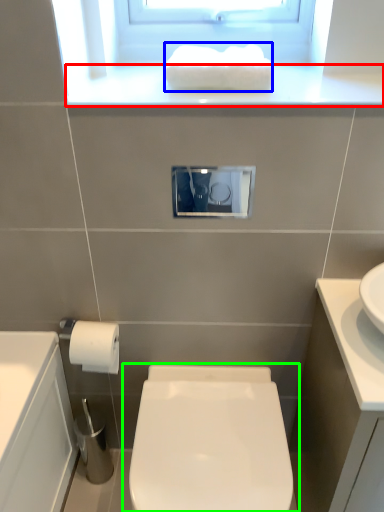
Question: Which is nearer to the window sill (highlighted by a red box)? hand towel (highlighted by a blue box) or toilet (highlighted by a green box).

Choices:
 (A) hand towel
 (B) toilet

Answer: (A)